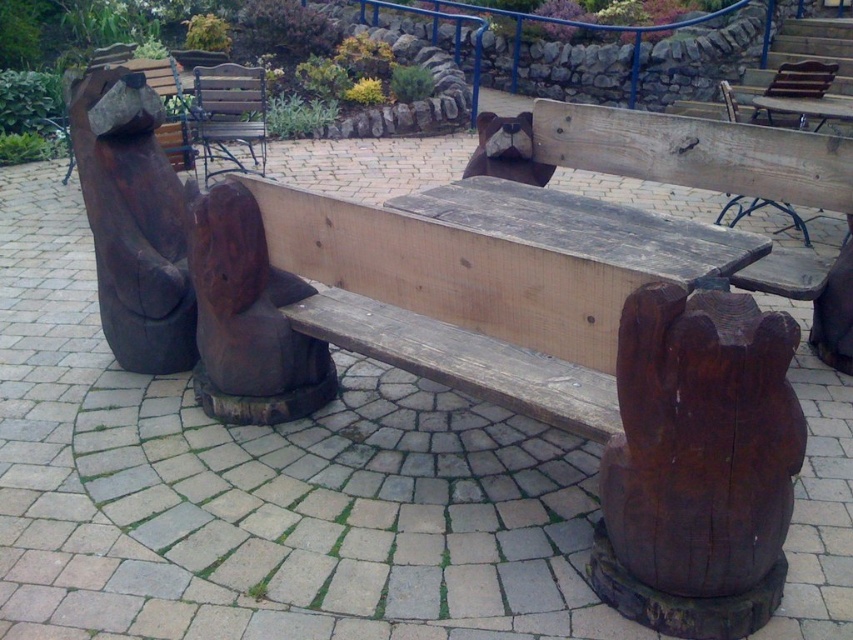
Can you confirm if rustic wood bear at left is bigger than wooden slats bench at center?

No.

Does rustic wood bear at left appear on the left side of wooden slats bench at center?

Incorrect, rustic wood bear at left is not on the left side of wooden slats bench at center.

Is point (137, 234) farther from viewer compared to point (242, 124)?

No.

Identify the location of rustic wood bear at left. pyautogui.click(x=187, y=268).